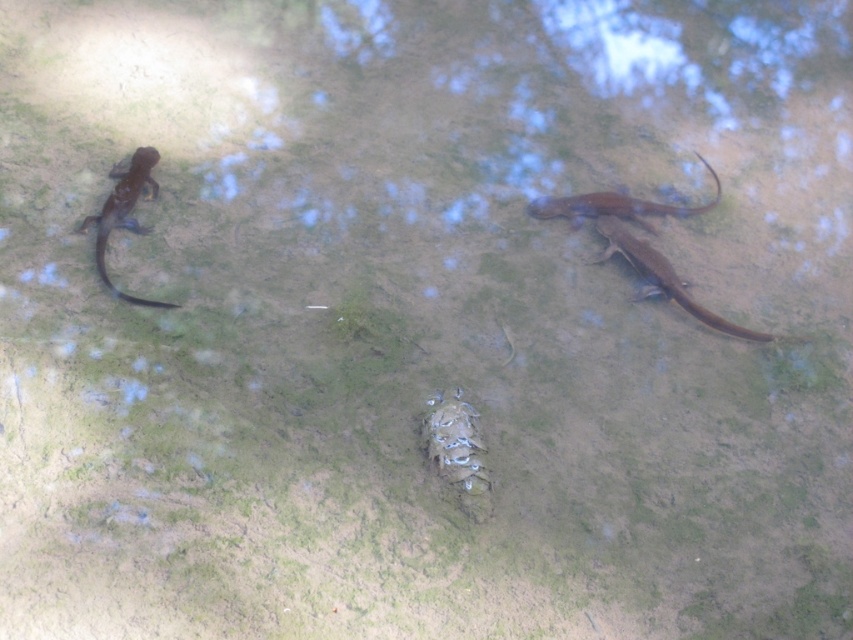
Question: Is brown matte lizard at right positioned before shiny brown lizard at upper right?

Choices:
 (A) no
 (B) yes

Answer: (B)

Question: Can you confirm if brown matte lizard at right is bigger than shiny brown lizard at upper right?

Choices:
 (A) no
 (B) yes

Answer: (B)

Question: Which of the following is the farthest from the observer?

Choices:
 (A) (619, 252)
 (B) (119, 296)
 (C) (592, 212)

Answer: (C)

Question: Which point appears closest to the camera in this image?

Choices:
 (A) (776, 337)
 (B) (102, 230)

Answer: (A)

Question: From the image, what is the correct spatial relationship of shiny blue lizard at left in relation to shiny brown lizard at upper right?

Choices:
 (A) left
 (B) right

Answer: (A)

Question: Estimate the real-world distances between objects in this image. Which object is farther from the shiny brown lizard at upper right?

Choices:
 (A) brown matte lizard at right
 (B) shiny blue lizard at left

Answer: (B)